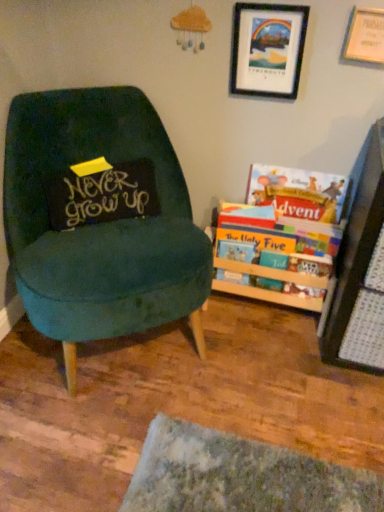
At what (x,y) coordinates should I click in order to perform the action: click on free location in front of hardcover book at right, placed as the 2th book when sorted from top to bottom. Please return your answer as a coordinate pair (x, y). Image resolution: width=384 pixels, height=512 pixels. Looking at the image, I should click on (276, 367).